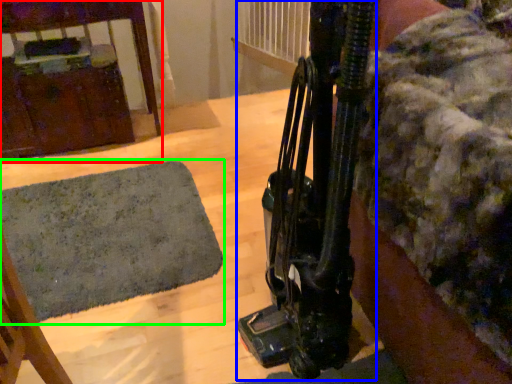
Question: Which object is the farthest from furniture (highlighted by a red box)? Choose among these: equipment (highlighted by a blue box) or mat (highlighted by a green box).

Choices:
 (A) equipment
 (B) mat

Answer: (A)